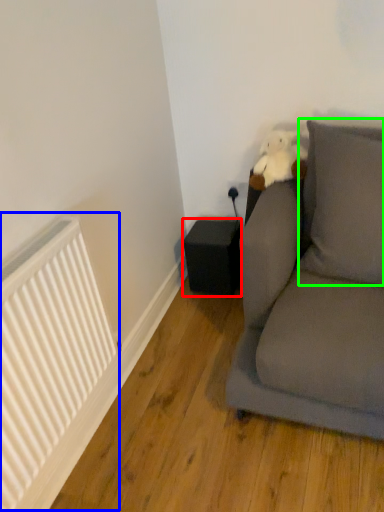
Question: Which is nearer to the speaker (highlighted by a red box)? radiator (highlighted by a blue box) or pillow (highlighted by a green box).

Choices:
 (A) radiator
 (B) pillow

Answer: (B)